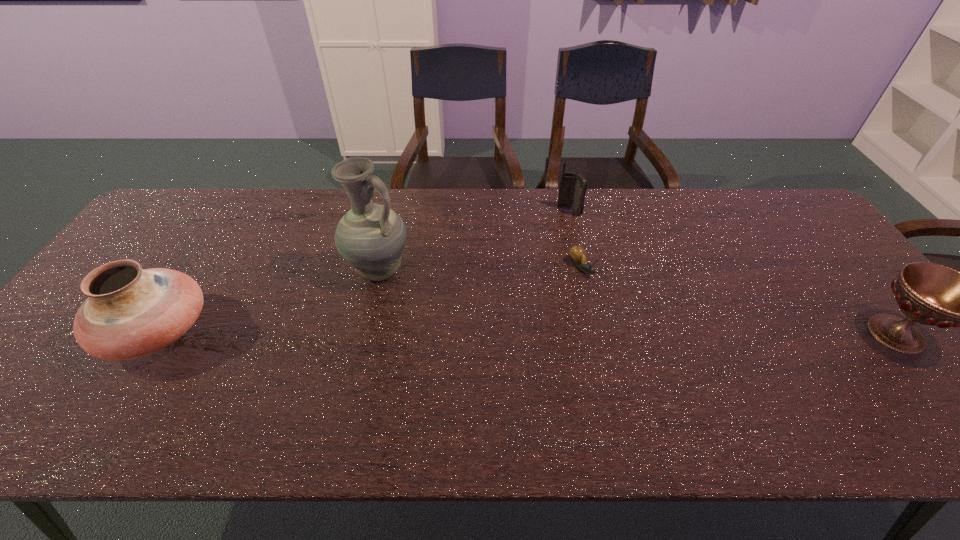
Find the location of a particular element. free space between the rightmost object and the cellular telephone is located at coordinates (732, 272).

This screenshot has width=960, height=540. Find the location of `free space between the chalice and the shortest object`. free space between the chalice and the shortest object is located at coordinates (739, 301).

This screenshot has width=960, height=540. What are the coordinates of `free space between the pottery and the escargot` in the screenshot? It's located at (370, 300).

Locate an element on the screen. Image resolution: width=960 pixels, height=540 pixels. free space between the shortest object and the leftmost object is located at coordinates (370, 300).

Locate an element on the screen. Image resolution: width=960 pixels, height=540 pixels. free spot between the chalice and the cellular telephone is located at coordinates (732, 272).

Where is `free spot between the chalice and the escargot`? free spot between the chalice and the escargot is located at coordinates (739, 301).

Find the location of `vacant space that is in between the pottery and the rightmost object`. vacant space that is in between the pottery and the rightmost object is located at coordinates (527, 333).

In order to click on free space between the leftmost object and the tallest object in this screenshot , I will do `click(269, 301)`.

Identify which object is located as the nearest to the tallest object. Please provide its 2D coordinates. Your answer should be formatted as a tuple, i.e. [(x, y)], where the tuple contains the x and y coordinates of a point satisfying the conditions above.

[(130, 312)]

At what (x,y) coordinates should I click in order to perform the action: click on object that can be found as the fourth closest to the shortest object. Please return your answer as a coordinate pair (x, y). This screenshot has width=960, height=540. Looking at the image, I should click on (130, 312).